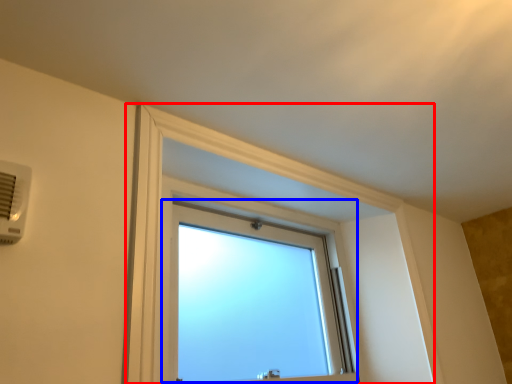
Question: Among these objects, which one is nearest to the camera, bay window (highlighted by a red box) or window (highlighted by a blue box)?

Choices:
 (A) bay window
 (B) window

Answer: (A)